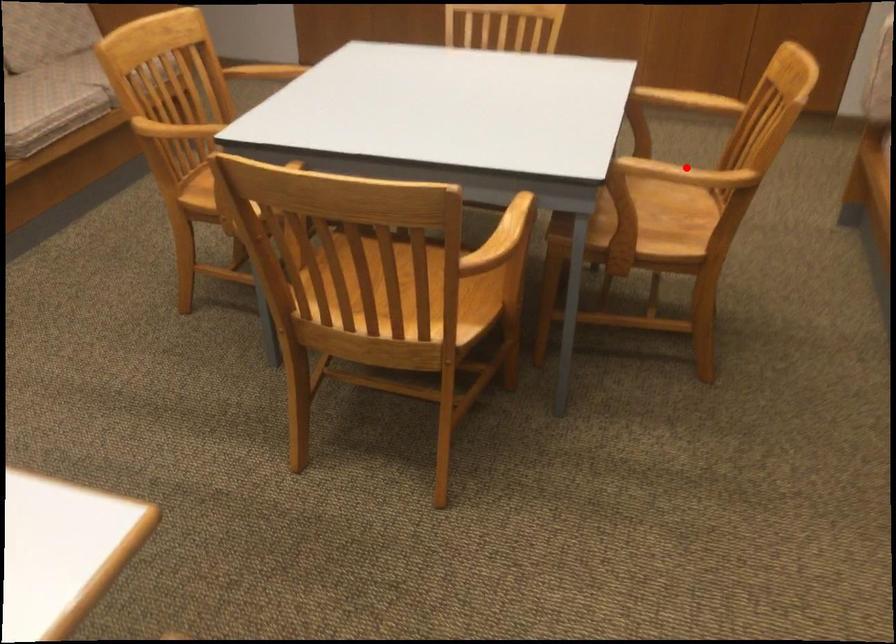
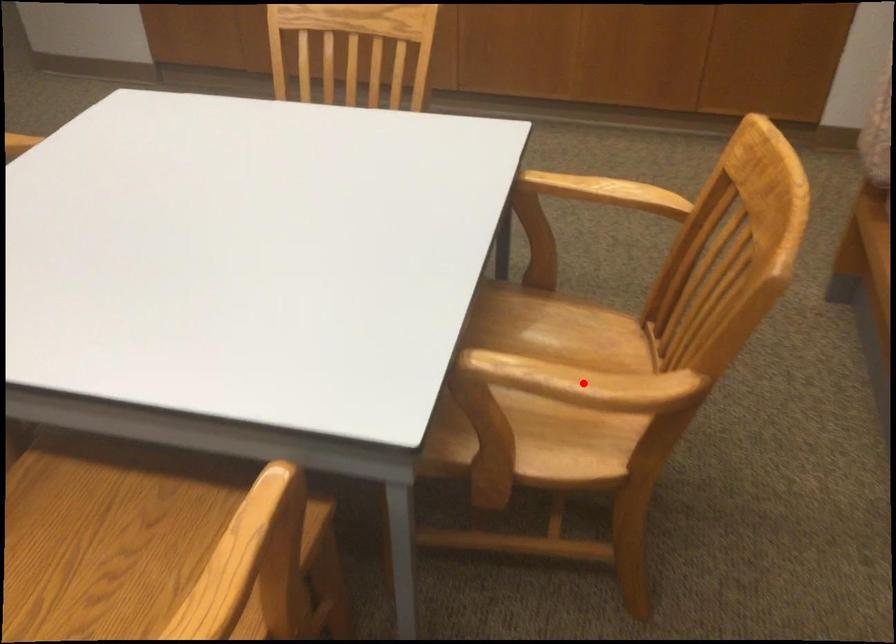
I am providing you with two images of the same scene from different viewpoints. A red point is marked on the first image and another point is marked on the second image. Are the points marked in image1 and image2 representing the same 3D position?

Yes